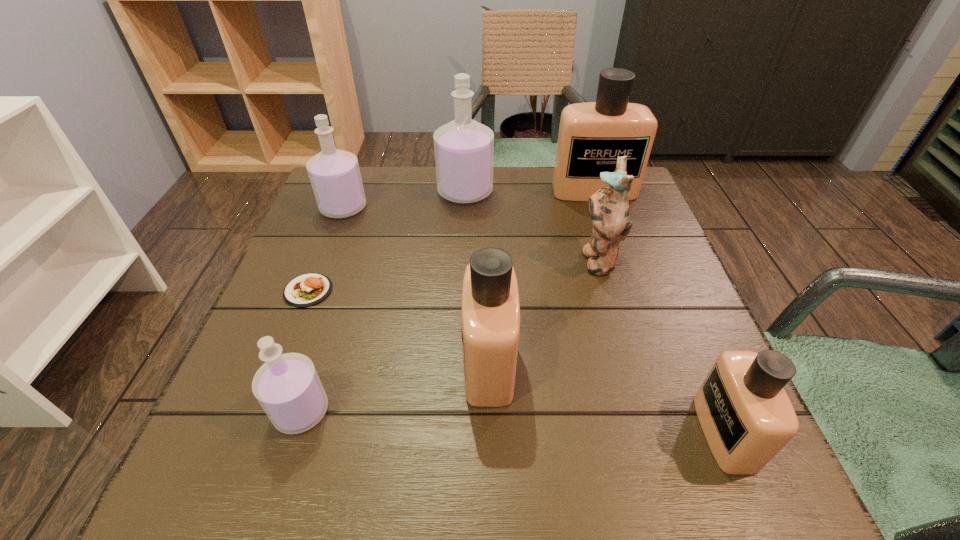
You are a GUI agent. You are given a task and a screenshot of the screen. Output one action in this format:
    pyautogui.click(x=<x>, y=<y>)
    Task: Click on the free space between the figurine and the second biggest purple perfume
    
    Given the screenshot: What is the action you would take?
    pyautogui.click(x=470, y=233)

I want to click on free point between the smallest purple perfume and the farthest beige perfume, so click(447, 301).

Locate an element on the screen. This screenshot has width=960, height=540. vacant area that lies between the leftmost beige perfume and the pink figurine is located at coordinates (543, 311).

Where is `vacant area between the smallest beige perfume and the farthest beige perfume`? The image size is (960, 540). vacant area between the smallest beige perfume and the farthest beige perfume is located at coordinates (659, 312).

Identify which object is located as the third nearest to the second biggest beige perfume. Please provide its 2D coordinates. Your answer should be formatted as a tuple, i.e. [(x, y)], where the tuple contains the x and y coordinates of a point satisfying the conditions above.

[(309, 289)]

Select which object is the fifth closest to the farthest beige perfume. Please provide its 2D coordinates. Your answer should be formatted as a tuple, i.e. [(x, y)], where the tuple contains the x and y coordinates of a point satisfying the conditions above.

[(747, 417)]

Identify which perfume is the second nearest to the patty (food). Please provide its 2D coordinates. Your answer should be formatted as a tuple, i.e. [(x, y)], where the tuple contains the x and y coordinates of a point satisfying the conditions above.

[(334, 174)]

Find the location of a particular element. The width and height of the screenshot is (960, 540). the closest perfume to the rightmost purple perfume is located at coordinates (592, 135).

Select which purple perfume is the closest to the patty (food). Please provide its 2D coordinates. Your answer should be formatted as a tuple, i.e. [(x, y)], where the tuple contains the x and y coordinates of a point satisfying the conditions above.

[(287, 386)]

The width and height of the screenshot is (960, 540). What are the coordinates of `purple perfume that stands as the closest to the second smallest purple perfume` in the screenshot? It's located at (464, 149).